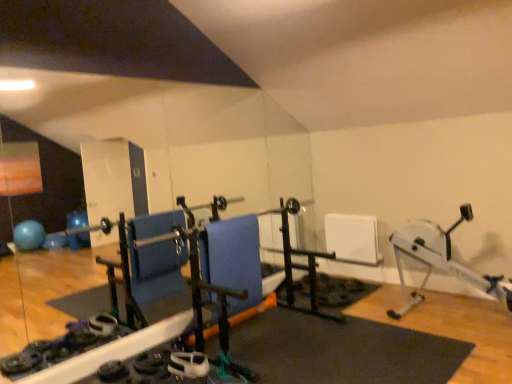
Find the location of a particular element. blue fabric swivel chair at center is located at coordinates (238, 265).

The width and height of the screenshot is (512, 384). What do you see at coordinates (238, 265) in the screenshot? I see `blue fabric swivel chair at center` at bounding box center [238, 265].

At what (x,y) coordinates should I click in order to perform the action: click on blue fabric swivel chair at center. Please return your answer as a coordinate pair (x, y). Looking at the image, I should click on 238,265.